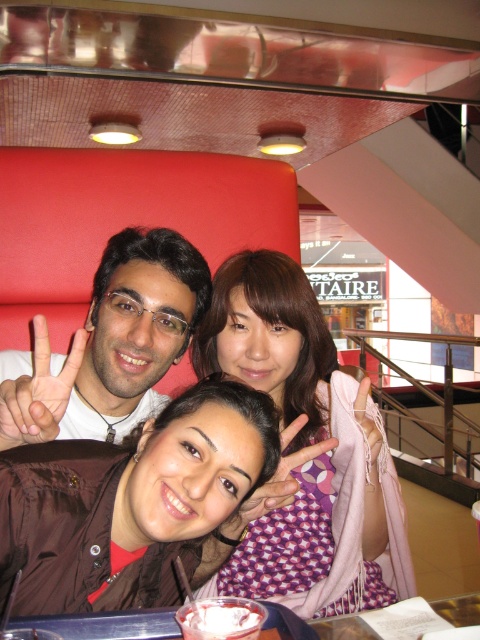
Question: Is purple dotted scarf at center further to camera compared to matte white shirt at center?

Choices:
 (A) yes
 (B) no

Answer: (A)

Question: Which point is farther from the camera taking this photo?

Choices:
 (A) (307, 440)
 (B) (8, 440)
 (C) (104, 422)

Answer: (C)

Question: Can you confirm if matte white shirt at center is positioned to the left of matte black hand at center?

Choices:
 (A) yes
 (B) no

Answer: (A)

Question: Which object is farther from the camera taking this photo?

Choices:
 (A) purple dotted scarf at center
 (B) matte white shirt at center
 (C) matte black hand at center

Answer: (A)

Question: Does purple dotted scarf at center have a greater width compared to matte white shirt at center?

Choices:
 (A) no
 (B) yes

Answer: (B)

Question: Which point appears closest to the camera in this image?

Choices:
 (A) (232, 564)
 (B) (113, 250)
 (C) (34, 442)

Answer: (C)